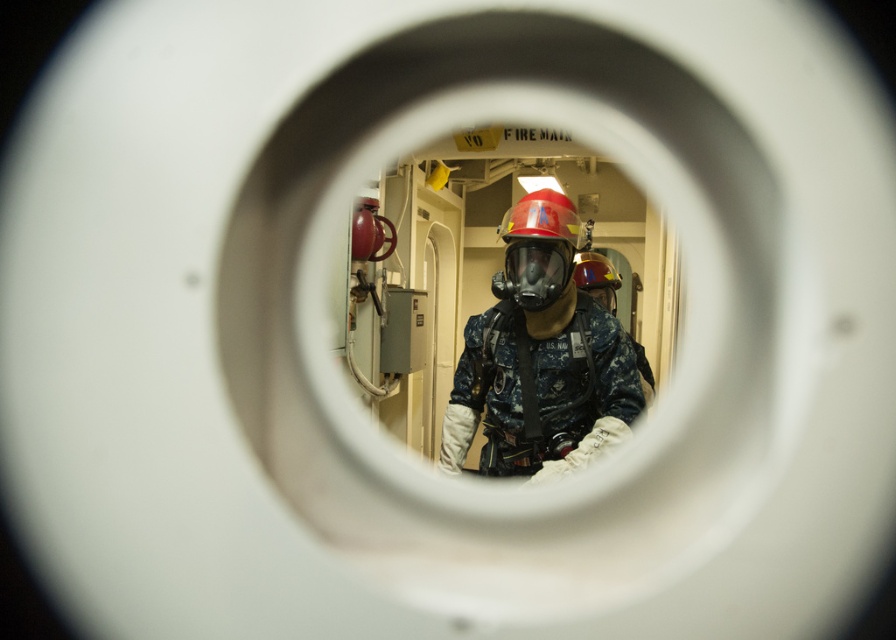
Does shiny red helmet at center appear on the right side of matte black helmet at center?

In fact, shiny red helmet at center is to the left of matte black helmet at center.

The width and height of the screenshot is (896, 640). What do you see at coordinates (538, 248) in the screenshot?
I see `shiny red helmet at center` at bounding box center [538, 248].

Measure the distance between shiny red helmet at center and camera.

shiny red helmet at center and camera are 6.34 feet apart from each other.

Locate an element on the screen. This screenshot has height=640, width=896. shiny red helmet at center is located at coordinates (538, 248).

Between point (530, 296) and point (602, 275), which one is positioned behind?

Positioned behind is point (602, 275).

Which is behind, point (561, 237) or point (576, 268)?

The point (576, 268) is more distant.

Locate an element on the screen. blue camouflage uniform at center is located at coordinates (540, 356).

Who is higher up, blue camouflage uniform at center or shiny red helmet at center?

Positioned higher is shiny red helmet at center.

Identify the location of blue camouflage uniform at center. The image size is (896, 640). (540, 356).

Between point (573, 378) and point (519, 300), which one is positioned in front?

Point (519, 300) is in front.

This screenshot has width=896, height=640. I want to click on blue camouflage uniform at center, so click(x=540, y=356).